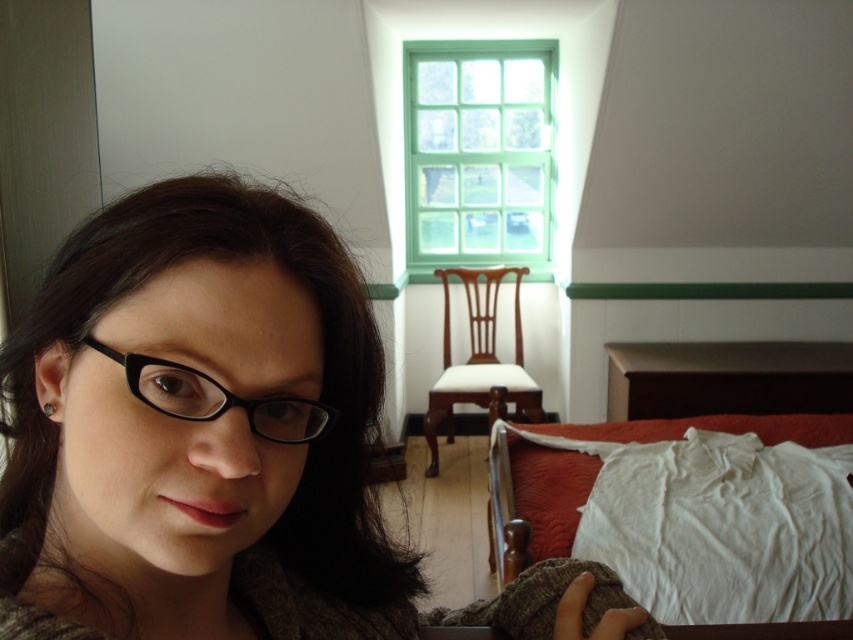
You are taking a photo of the green painted wood window at upper center and the black plastic glasses at left. Which object is positioned to the right of the other?

The green painted wood window at upper center is to the right of black plastic glasses at left.

You are a photographer trying to capture a portrait of the person in the room. You notice the green painted wood window at upper center and the black plastic glasses at left. Which object is taller in the image?

The green painted wood window at upper center is much taller than the black plastic glasses at left.